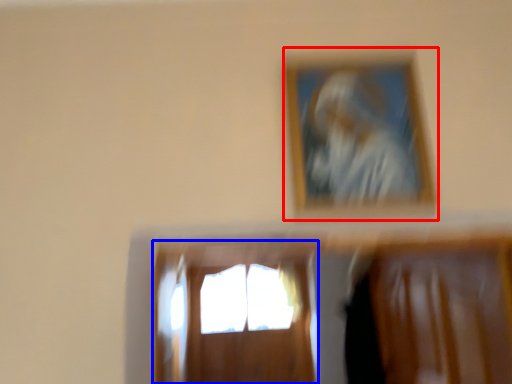
Question: Which object is closer to the camera taking this photo, picture frame (highlighted by a red box) or window (highlighted by a blue box)?

Choices:
 (A) picture frame
 (B) window

Answer: (A)